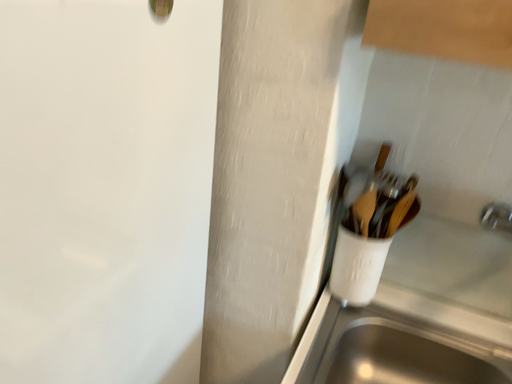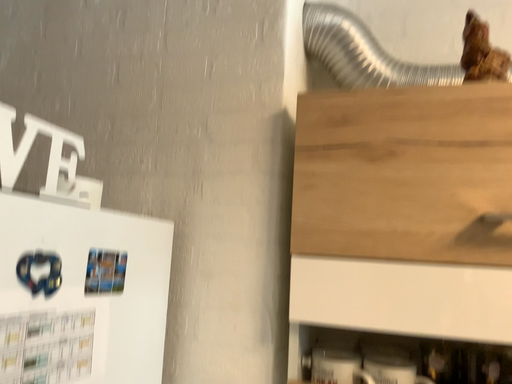
Question: How did the camera likely rotate when shooting the video?

Choices:
 (A) rotated upward
 (B) rotated downward

Answer: (A)